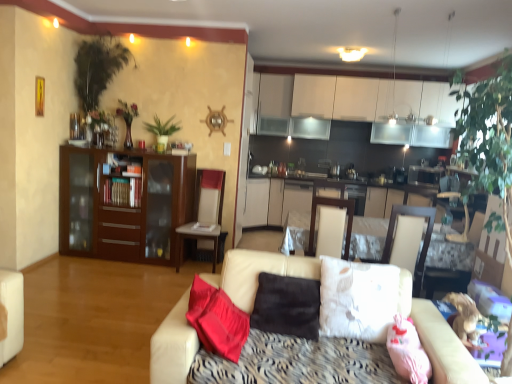
The height and width of the screenshot is (384, 512). In order to click on free space in front of brown wood cabinet at left in this screenshot , I will do `click(106, 282)`.